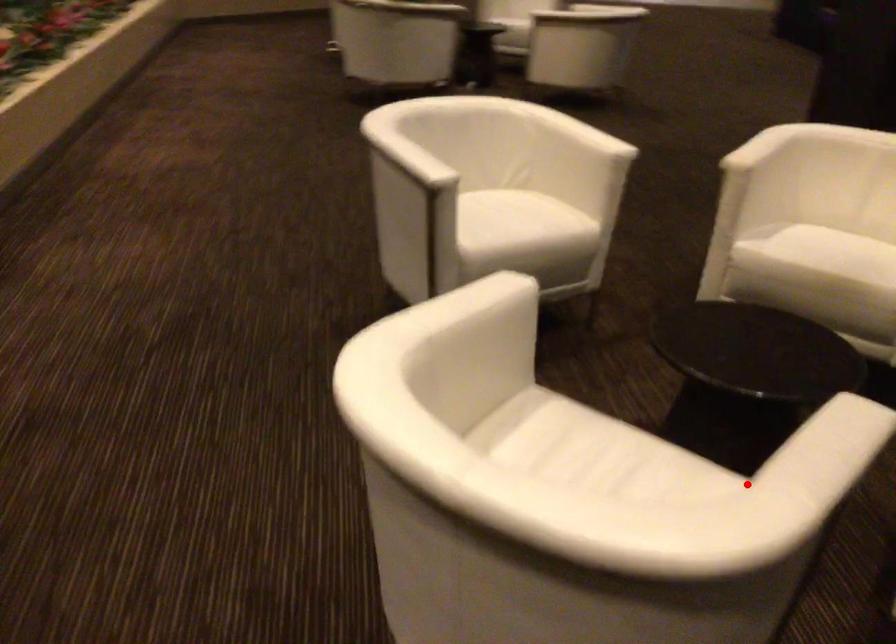
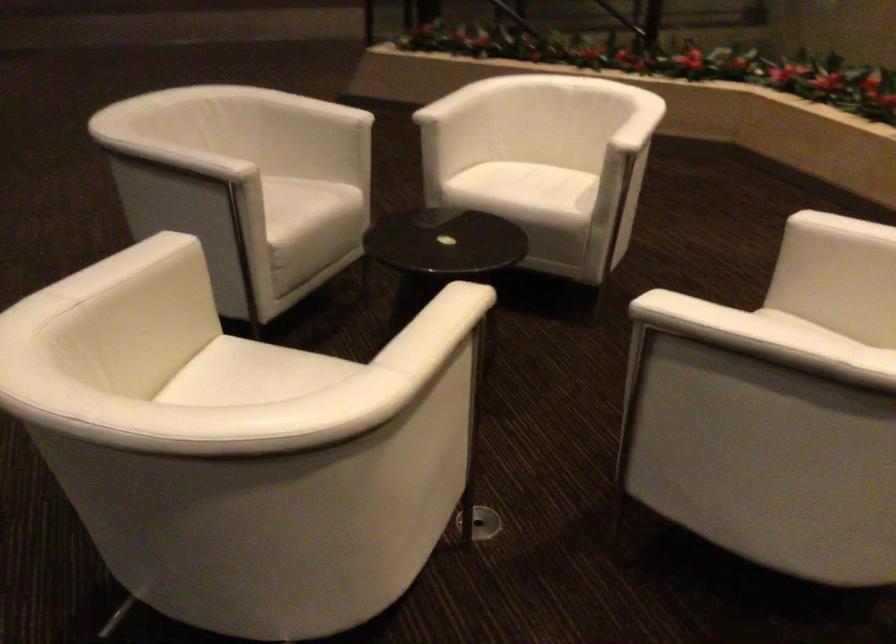
The point at the highlighted location is marked in the first image. Where is the corresponding point in the second image?

(469, 89)